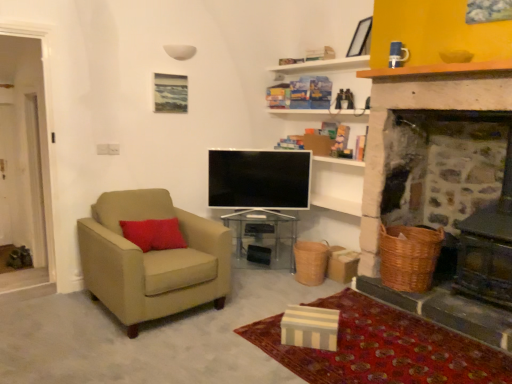
Locate an element on the screen. The width and height of the screenshot is (512, 384). free point to the right of beige fabric armchair at left is located at coordinates (250, 304).